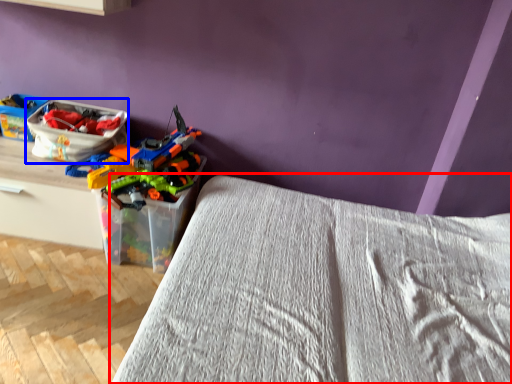
Question: Which object appears closest to the camera in this image, bed (highlighted by a red box) or kit (highlighted by a blue box)?

Choices:
 (A) bed
 (B) kit

Answer: (A)